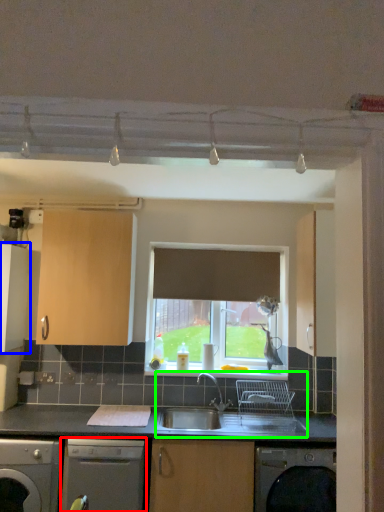
Question: Which object is the closest to the dishwasher (highlighted by a red box)? Choose among these: cabinetry (highlighted by a blue box) or sink (highlighted by a green box).

Choices:
 (A) cabinetry
 (B) sink

Answer: (B)